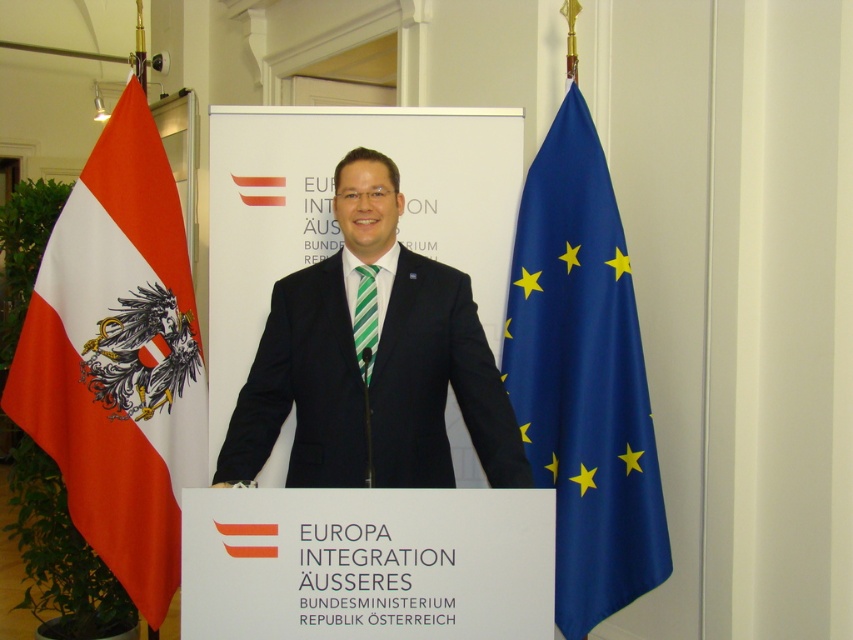
Who is more forward, (566, 579) or (360, 364)?

Positioned in front is point (360, 364).

Between blue satin flag at right and green striped tie at center, which one has more height?

blue satin flag at right

Between point (543, 436) and point (352, 326), which one is positioned in front?

Point (352, 326)

The image size is (853, 640). I want to click on blue satin flag at right, so click(583, 378).

Is point (85, 429) positioned in front of point (564, 246)?

No, (85, 429) is behind (564, 246).

Can you confirm if red-white fabric flag at left is bigger than blue satin flag at right?

Yes.

Between point (67, 467) and point (618, 412), which one is positioned behind?

The point (67, 467) is more distant.

At what (x,y) coordinates should I click in order to perform the action: click on red-white fabric flag at left. Please return your answer as a coordinate pair (x, y). Looking at the image, I should click on (119, 358).

Who is shorter, black suit at center or green striped tie at center?

With less height is green striped tie at center.

From the picture: Between black suit at center and green striped tie at center, which one appears on the left side from the viewer's perspective?

black suit at center is more to the left.

Which is in front, point (287, 321) or point (368, 378)?

Point (368, 378)

Image resolution: width=853 pixels, height=640 pixels. I want to click on black suit at center, so click(x=373, y=364).